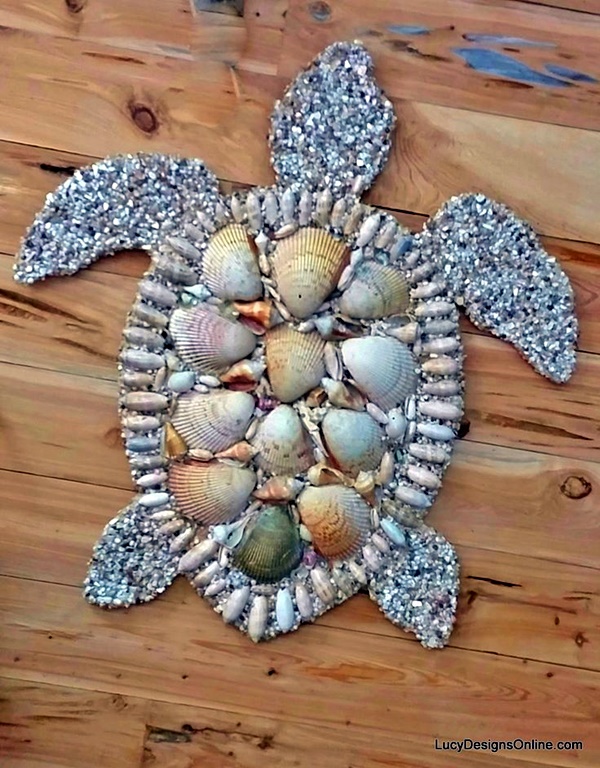
Identify the location of decorative sea turtle art piece. (356, 130).